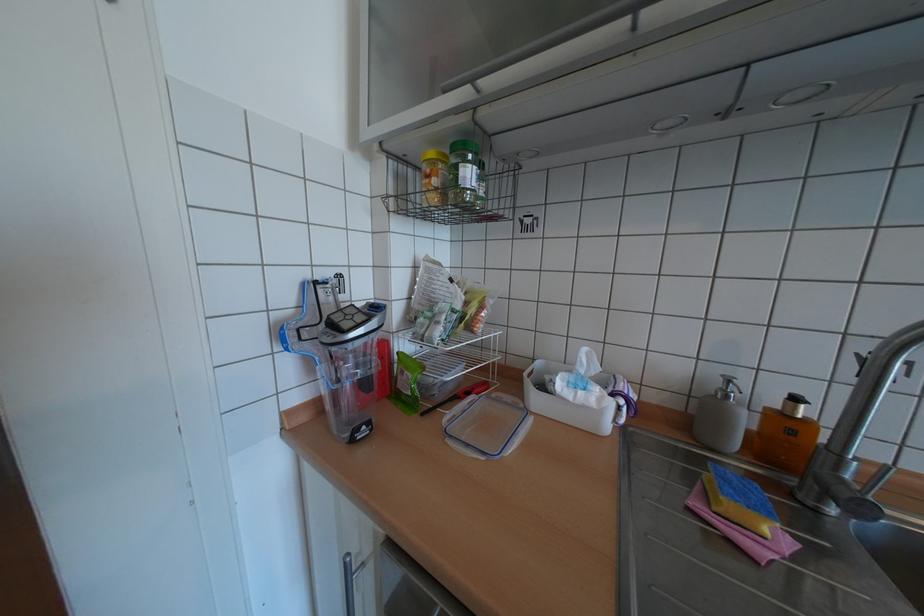
You are a GUI agent. You are given a task and a screenshot of the screen. Output one action in this format:
    pyautogui.click(x=<x>, y=<y>)
    Task: Click on the faucet handle
    
    Given the screenshot: What is the action you would take?
    pyautogui.click(x=859, y=495)